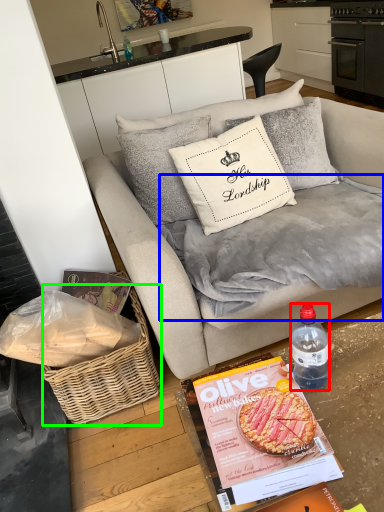
Question: Estimate the real-world distances between objects in this image. Which object is closer to bottle (highlighted by a red box), blanket (highlighted by a blue box) or picnic basket (highlighted by a green box)?

Choices:
 (A) blanket
 (B) picnic basket

Answer: (A)